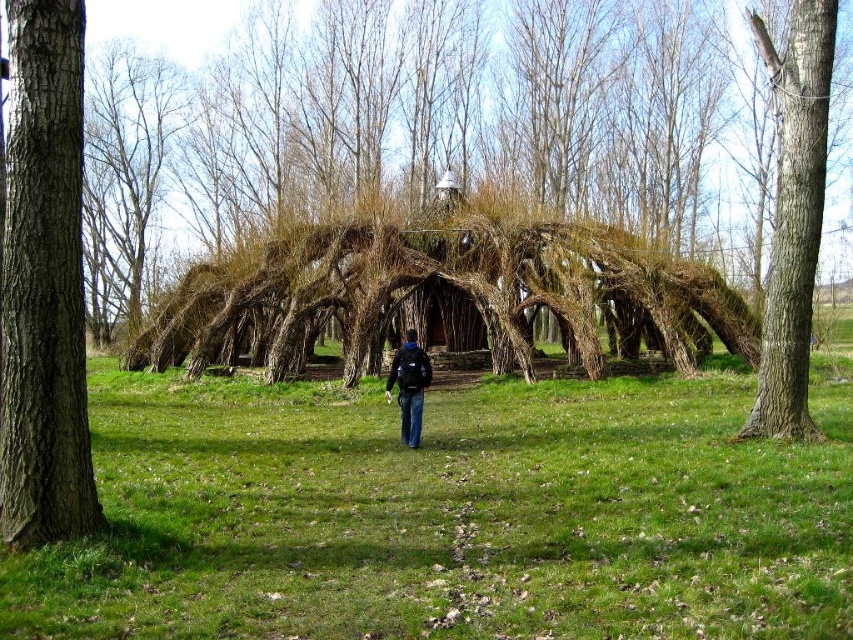
Is point (219, 561) closer to camera compared to point (410, 408)?

Yes, it is.

Who is more distant from viewer, (305, 433) or (404, 342)?

Point (404, 342)

Where is `green grass at center`? This screenshot has width=853, height=640. green grass at center is located at coordinates (450, 515).

How distant is brown rough tree trunk at left from dark blue jeans at center?

brown rough tree trunk at left and dark blue jeans at center are 5.44 meters apart from each other.

Is brown rough tree trunk at left above dark blue jeans at center?

Yes.

Is point (6, 460) positioned after point (405, 376)?

No, (6, 460) is closer to viewer.

This screenshot has height=640, width=853. In order to click on brown rough tree trunk at left in this screenshot , I will do `click(45, 284)`.

Is point (9, 433) closer to camera compared to point (796, 243)?

Yes.

This screenshot has height=640, width=853. Describe the element at coordinates (45, 284) in the screenshot. I see `brown rough tree trunk at left` at that location.

Between point (36, 273) and point (822, 38), which one is positioned in front?

Point (36, 273) is more forward.

Where is `brown rough tree trunk at left`? The width and height of the screenshot is (853, 640). brown rough tree trunk at left is located at coordinates (45, 284).